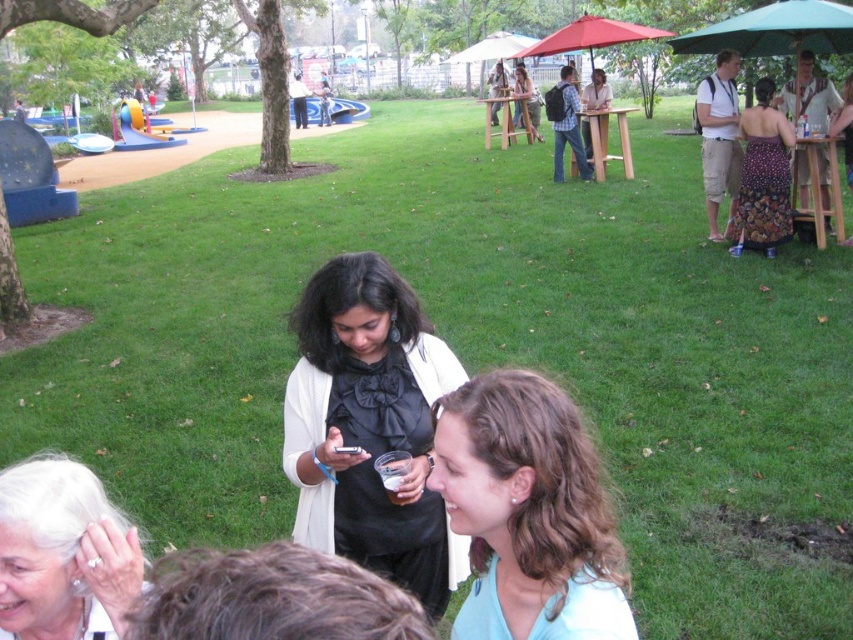
Which is below, white pearl earring at lower left or green fabric umbrella at right?

Positioned lower is white pearl earring at lower left.

Between point (122, 540) and point (722, 38), which one is positioned in front?

Point (122, 540) is in front.

Identify the location of white pearl earring at lower left. (62, 554).

Between black satin dress at center and wooden picnic table at center, which one has more height?

black satin dress at center

Is black satin dress at center to the right of wooden picnic table at center from the viewer's perspective?

In fact, black satin dress at center is to the left of wooden picnic table at center.

Is point (387, 387) positioned behind point (524, 108)?

No, it is in front of (524, 108).

I want to click on black satin dress at center, so click(369, 426).

Is green fabric umbrella at right positioned behind light brown wooden picnic table at center?

No, it is in front of light brown wooden picnic table at center.

Does green fabric umbrella at right appear under light brown wooden picnic table at center?

No, green fabric umbrella at right is not below light brown wooden picnic table at center.

You are a GUI agent. You are given a task and a screenshot of the screen. Output one action in this format:
    pyautogui.click(x=<x>, y=<y>)
    Task: Click on the green fabric umbrella at right
    
    Given the screenshot: What is the action you would take?
    pyautogui.click(x=776, y=32)

Where is `green fabric umbrella at right`? The image size is (853, 640). green fabric umbrella at right is located at coordinates (776, 32).